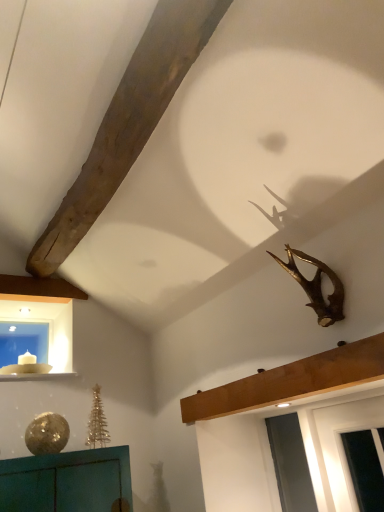
Question: Can we say white glossy window sill at lower left lies outside wooden beam at upper center?

Choices:
 (A) no
 (B) yes

Answer: (B)

Question: From the image's perspective, is white glossy window sill at lower left on wooden beam at upper center?

Choices:
 (A) yes
 (B) no

Answer: (B)

Question: From the image's perspective, is white glossy window sill at lower left below wooden beam at upper center?

Choices:
 (A) yes
 (B) no

Answer: (A)

Question: Is white glossy window sill at lower left facing away from wooden beam at upper center?

Choices:
 (A) yes
 (B) no

Answer: (B)

Question: Is white glossy window sill at lower left not near wooden beam at upper center?

Choices:
 (A) yes
 (B) no

Answer: (A)

Question: Which is correct: wooden beam at upper center is inside blue glass window at lower left, or outside of it?

Choices:
 (A) inside
 (B) outside

Answer: (B)

Question: From the image's perspective, relative to blue glass window at lower left, is wooden beam at upper center above or below?

Choices:
 (A) above
 (B) below

Answer: (A)

Question: From a real-world perspective, relative to blue glass window at lower left, is wooden beam at upper center vertically above or below?

Choices:
 (A) above
 (B) below

Answer: (B)

Question: Is wooden beam at upper center in front of or behind blue glass window at lower left in the image?

Choices:
 (A) behind
 (B) front

Answer: (B)

Question: From the image's perspective, is blue glass window at lower left above or below gold metallic antlers at upper right?

Choices:
 (A) below
 (B) above

Answer: (A)

Question: Is blue glass window at lower left in front of or behind gold metallic antlers at upper right in the image?

Choices:
 (A) front
 (B) behind

Answer: (B)

Question: Considering the positions of blue glass window at lower left and gold metallic antlers at upper right in the image, is blue glass window at lower left wider or thinner than gold metallic antlers at upper right?

Choices:
 (A) thin
 (B) wide

Answer: (A)

Question: Would you say blue glass window at lower left is inside or outside gold metallic antlers at upper right?

Choices:
 (A) inside
 (B) outside

Answer: (B)

Question: Is blue glass window at lower left taller or shorter than white glossy window sill at lower left?

Choices:
 (A) tall
 (B) short

Answer: (A)

Question: Is blue glass window at lower left in front of or behind white glossy window sill at lower left in the image?

Choices:
 (A) front
 (B) behind

Answer: (B)